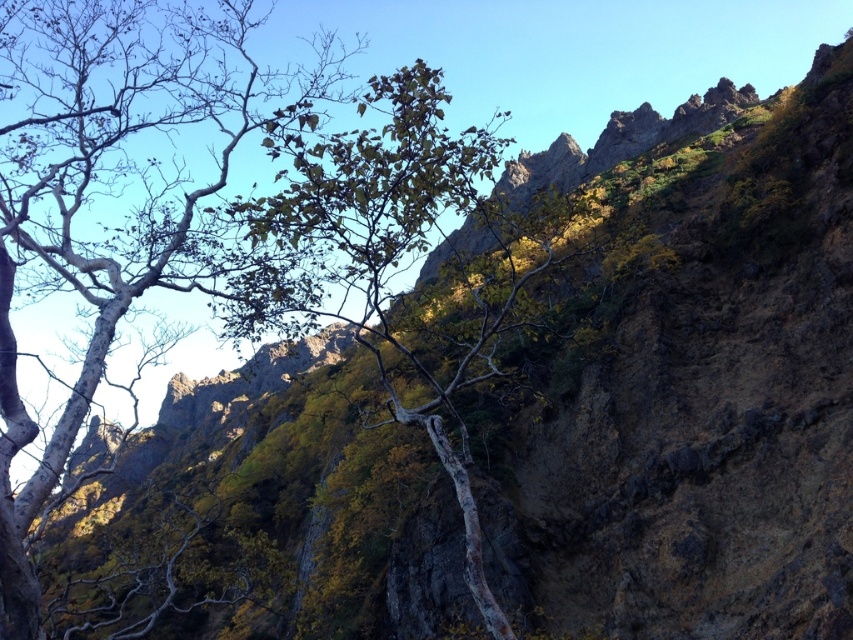
You are a hiker planning a route through the mountain landscape. You notice the smooth bark tree at left and the green leafy tree at center. Which tree would you encounter first if you start hiking from the bottom of the mountain upwards?

The smooth bark tree at left would be encountered first as it is positioned over the green leafy tree at center, meaning it is closer to the hiker starting from the bottom.

You are a hiker planning to traverse between the smooth bark tree at left and the green leafy tree at center. Given that your backpack has a weight limit of 20 kilograms, and the path between them requires carrying equipment for a 30 meter hike, will you be able to carry all necessary gear without exceeding the limit?

The distance between the smooth bark tree at left and the green leafy tree at center is 30.21 meters. Since the required equipment for a 30 meter hike does not exceed the 20 kg limit, you can carry all necessary gear without exceeding the backpack capacity.